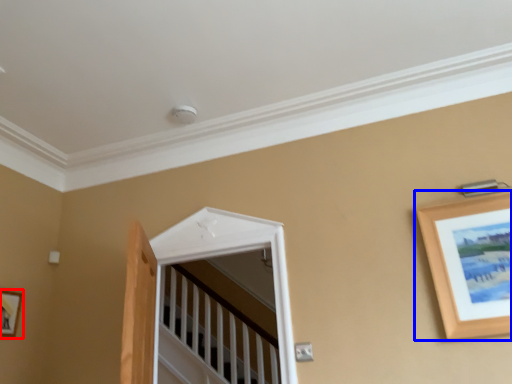
Question: Which object appears farthest to the camera in this image, picture frame (highlighted by a red box) or picture frame (highlighted by a blue box)?

Choices:
 (A) picture frame
 (B) picture frame

Answer: (A)